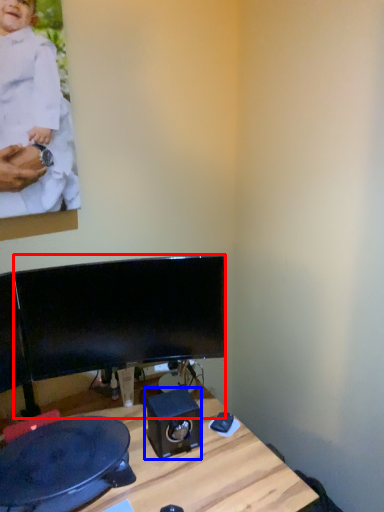
Question: Among these objects, which one is nearest to the camera, computer monitor (highlighted by a red box) or speaker (highlighted by a blue box)?

Choices:
 (A) computer monitor
 (B) speaker

Answer: (A)